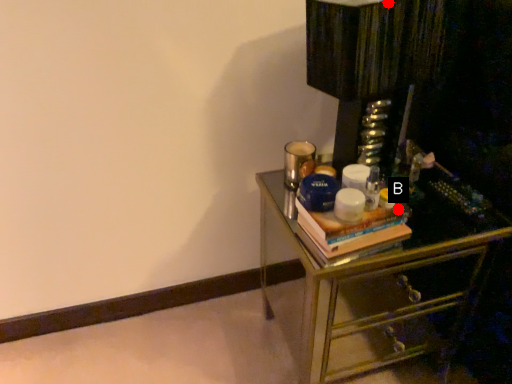
Question: Two points are circled on the image, labeled by A and B beside each circle. Which point is closer to the camera taking this photo?

Choices:
 (A) A is closer
 (B) B is closer

Answer: (A)